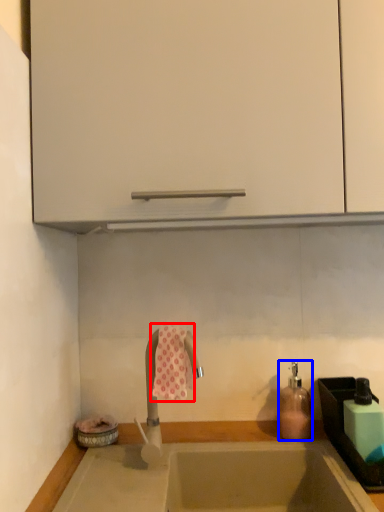
Question: Among these objects, which one is farthest to the camera, beach towel (highlighted by a red box) or soap dispenser (highlighted by a blue box)?

Choices:
 (A) beach towel
 (B) soap dispenser

Answer: (B)